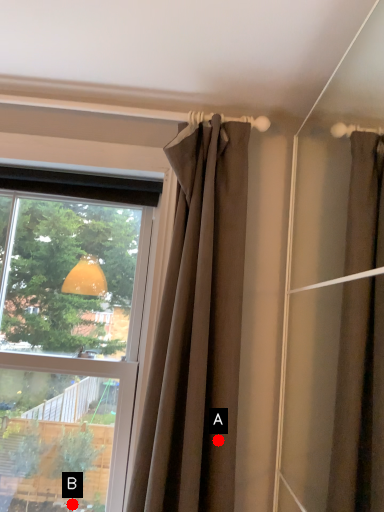
Question: Two points are circled on the image, labeled by A and B beside each circle. Which point appears closest to the camera in this image?

Choices:
 (A) A is closer
 (B) B is closer

Answer: (A)